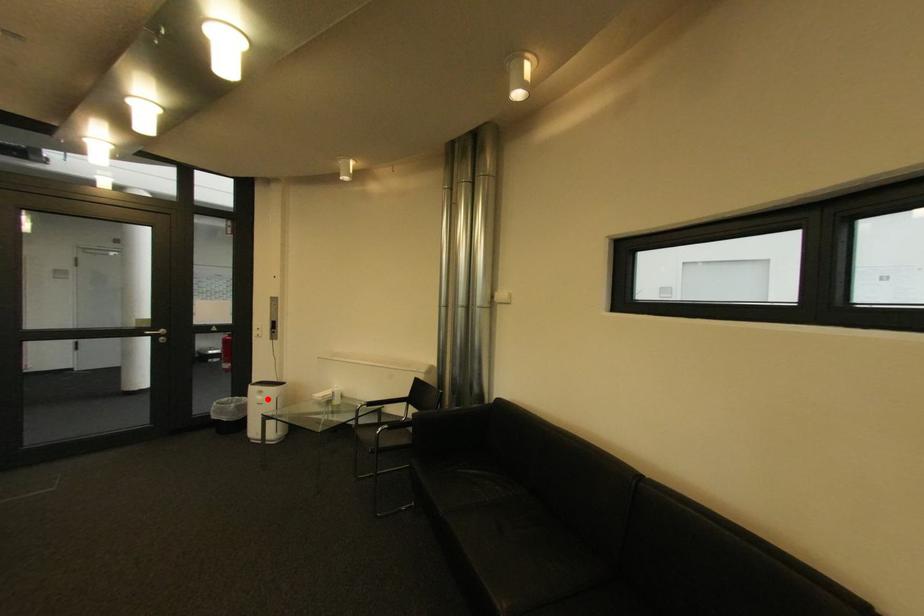
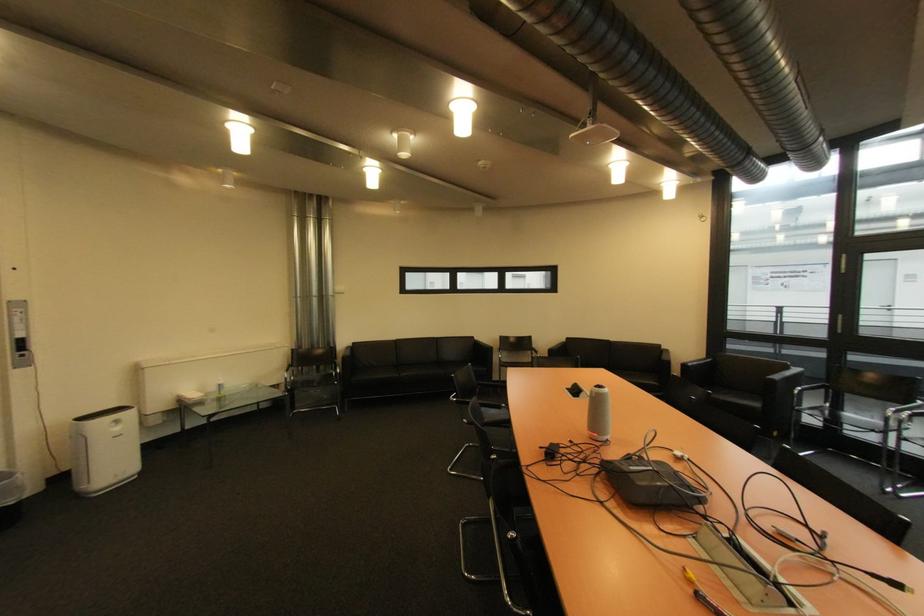
Question: I am providing you with two images of the same scene from different viewpoints. Given a red point in image1, look at the same physical point in image2. Is it:

Choices:
 (A) Closer to the viewpoint
 (B) Farther from the viewpoint

Answer: (A)